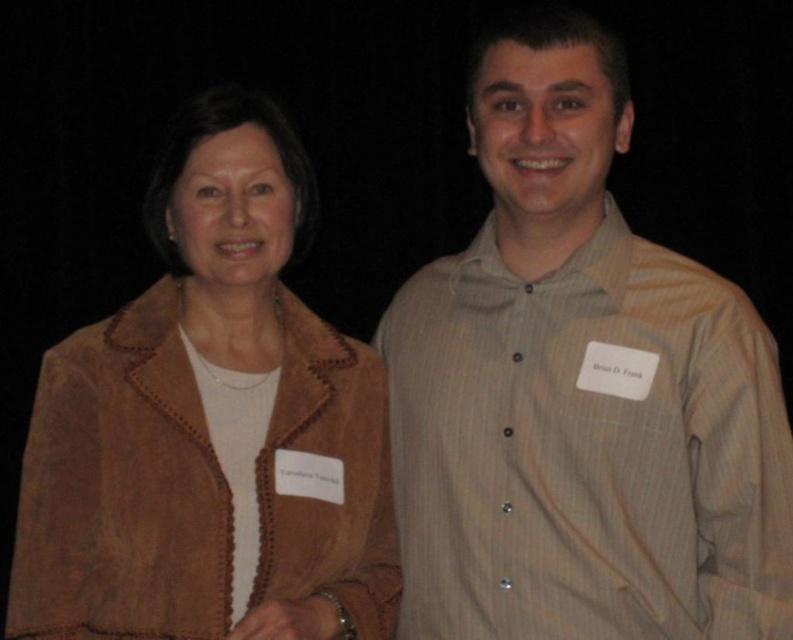
Question: Which point is closer to the camera?

Choices:
 (A) suede jacket at left
 (B) light brown striped shirt at center

Answer: (A)

Question: Which of the following is the closest to the observer?

Choices:
 (A) light brown striped shirt at center
 (B) suede jacket at left

Answer: (B)

Question: Which object appears closest to the camera in this image?

Choices:
 (A) suede jacket at left
 (B) light brown striped shirt at center

Answer: (A)

Question: Can you confirm if light brown striped shirt at center is bigger than suede jacket at left?

Choices:
 (A) yes
 (B) no

Answer: (A)

Question: Is light brown striped shirt at center thinner than suede jacket at left?

Choices:
 (A) yes
 (B) no

Answer: (B)

Question: Is light brown striped shirt at center bigger than suede jacket at left?

Choices:
 (A) no
 (B) yes

Answer: (B)